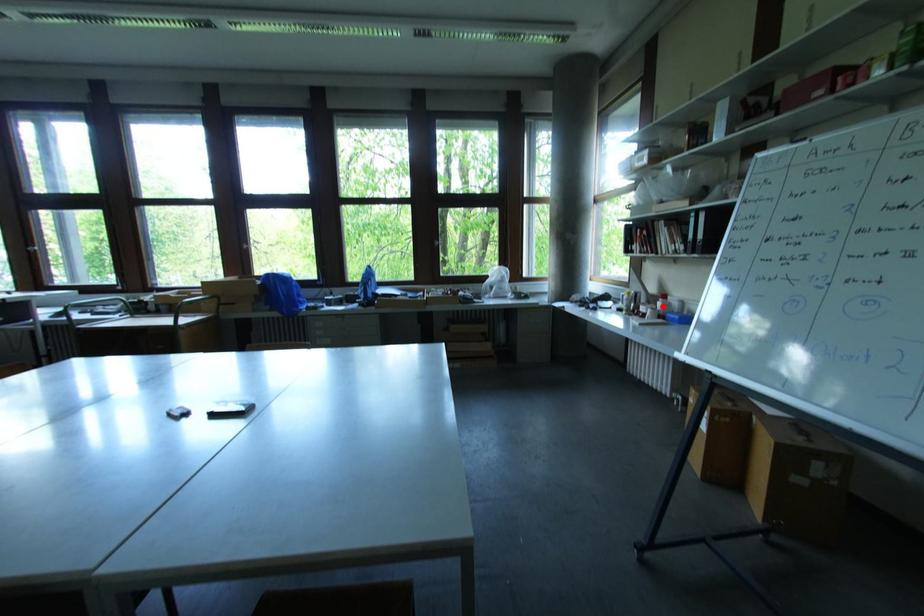
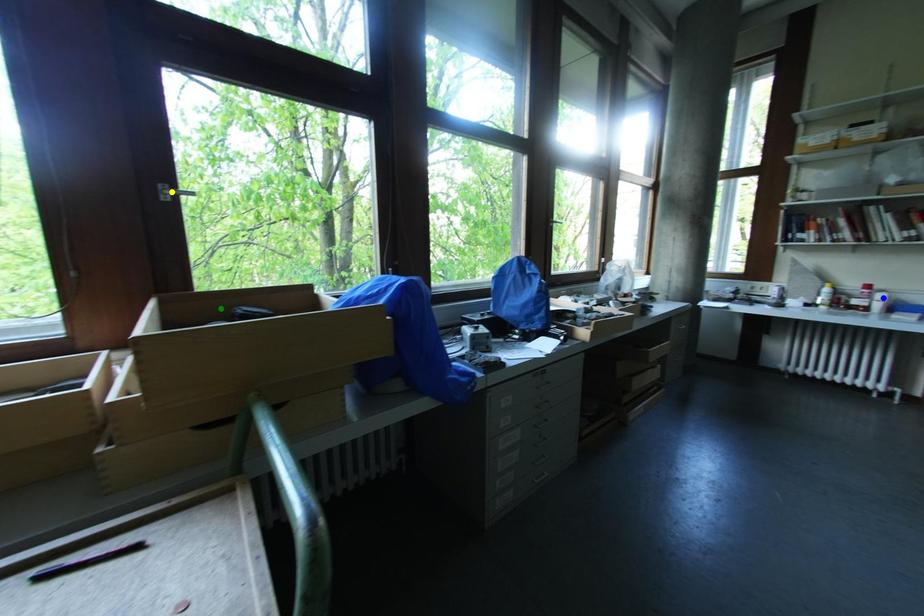
Question: I am providing you with two images of the same scene from different viewpoints. A red point is marked on the first image. You are given multiple points on the second image. Which point in image 2 represents the same 3d spot as the red point in image 1?

Choices:
 (A) blue point
 (B) yellow point
 (C) green point

Answer: (A)